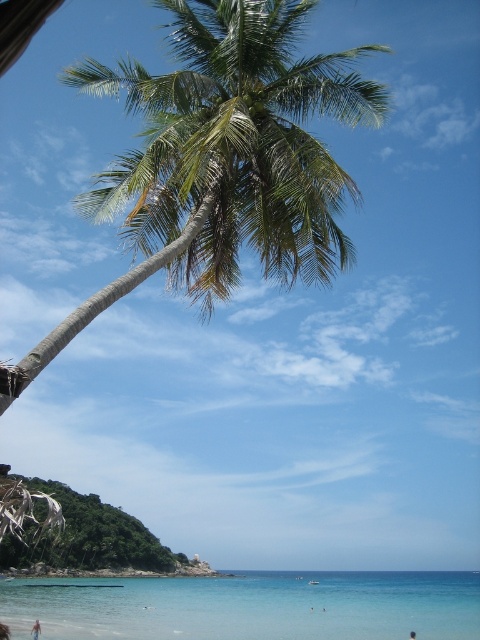
Question: Considering the real-world distances, which object is closest to the green leafy palm tree at upper center?

Choices:
 (A) black hair at lower center
 (B) clear blue water at lower center

Answer: (A)

Question: Is clear blue water at lower center further to camera compared to black hair at lower center?

Choices:
 (A) yes
 (B) no

Answer: (B)

Question: Which point is farther to the camera?

Choices:
 (A) (409, 634)
 (B) (115, 627)
 (C) (182, 24)

Answer: (A)

Question: Does green leafy palm tree at upper center appear over black hair at lower center?

Choices:
 (A) yes
 (B) no

Answer: (A)

Question: Among these objects, which one is farthest from the camera?

Choices:
 (A) black hair at lower center
 (B) clear blue water at lower center
 (C) green leafy palm tree at upper center

Answer: (A)

Question: Observing the image, what is the correct spatial positioning of green leafy palm tree at upper center in reference to clear blue water at lower center?

Choices:
 (A) above
 (B) below

Answer: (A)